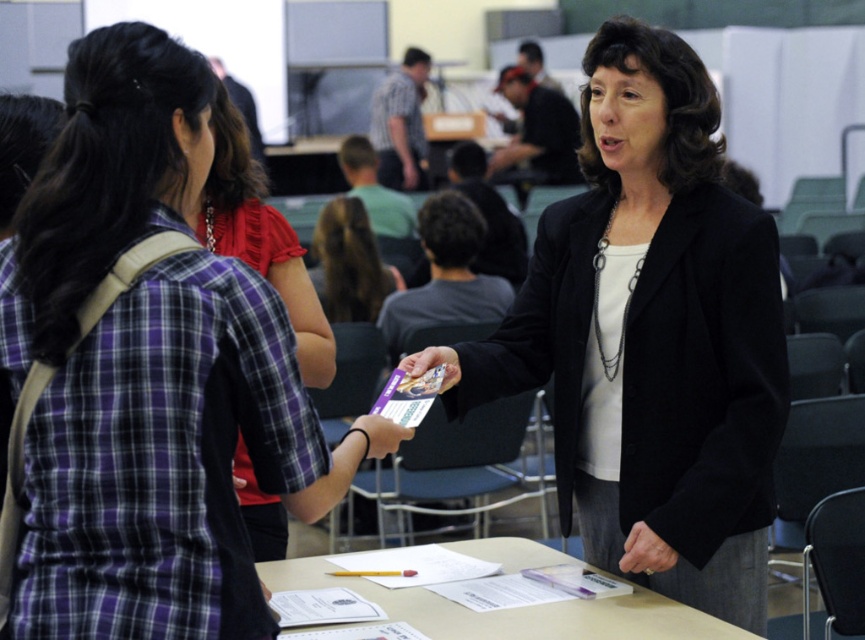
You are standing at the registration desk in the image. There is a point marked at coordinates (650, 337). What object is located at that point?

The point at coordinates (650, 337) marks the black matte blazer at center.

You are standing at the registration desk and want to move towards the two points marked in the scene. Which point, point (764, 532) or point (257, 269), is closer to you?

Point (764, 532) is closer to you because it is further to the viewer than point (257, 269).

You are an event planner organizing a job fair. You need to ensure that the registration desk is visible to all attendees. Based on the image, is the black matte blazer at center blocking the view of the registration desk for the person wearing the plaid fabric shirt at center?

The black matte blazer at center is positioned under the plaid fabric shirt at center, so the person in the plaid fabric shirt at center can still see over the blazer to view the registration desk.